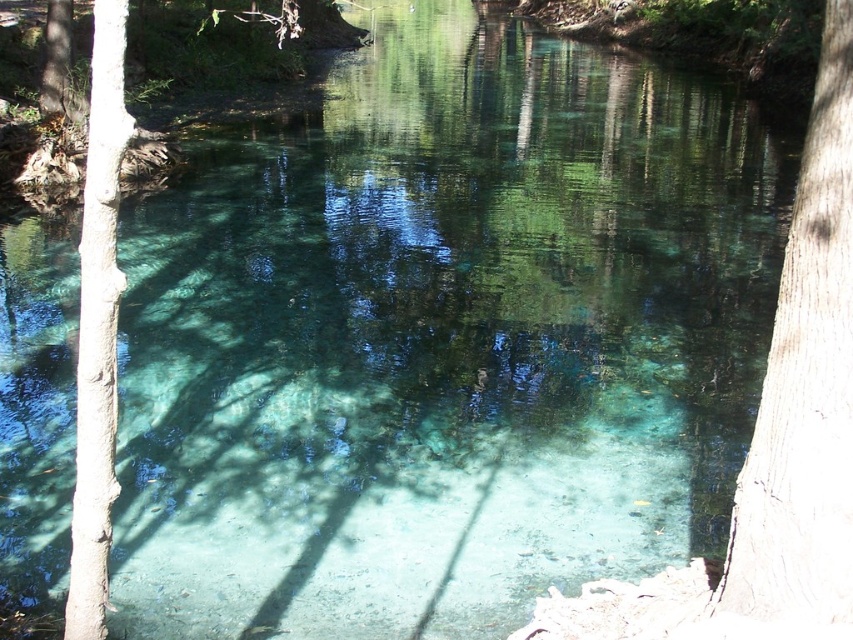
You are standing on the bank of the turquoise river and see the smooth brown tree trunk at right and the smooth bark tree at left. Which tree trunk is positioned higher relative to the other?

The smooth brown tree trunk at right is located above the smooth bark tree at left, so it is positioned higher.

You are standing at the center of the water and want to reach the shore. Which tree trunk, the smooth brown tree trunk at right or the smooth bark tree at left, is closer to you?

The smooth brown tree trunk at right is closer to you because it is bigger than the smooth bark tree at left, which suggests it is nearer.

You are standing near the water and see both the smooth brown tree trunk at right and the smooth bark tree at left. Which tree trunk is taller?

The smooth brown tree trunk at right is much taller than the smooth bark tree at left.